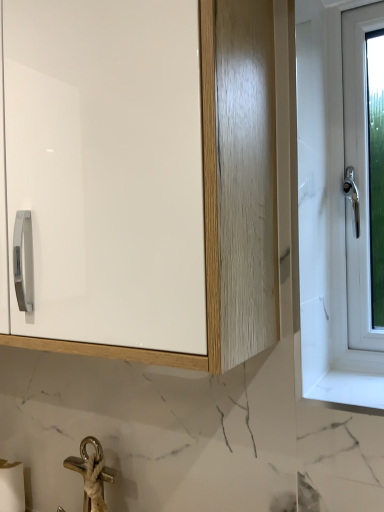
What is the approximate width of white matte toilet paper at lower left?

white matte toilet paper at lower left is 3.19 inches in width.

Where is `white matte toilet paper at lower left`? The image size is (384, 512). white matte toilet paper at lower left is located at coordinates (11, 487).

What is the approximate height of white matte toilet paper at lower left?

white matte toilet paper at lower left is 5.90 inches tall.

This screenshot has height=512, width=384. Describe the element at coordinates (11, 487) in the screenshot. I see `white matte toilet paper at lower left` at that location.

Where is `white glossy cabinet at upper left`? white glossy cabinet at upper left is located at coordinates 227,195.

Describe the element at coordinates (227, 195) in the screenshot. I see `white glossy cabinet at upper left` at that location.

Find the location of a particular element. Image resolution: width=384 pixels, height=512 pixels. white matte toilet paper at lower left is located at coordinates (11, 487).

Between white matte toilet paper at lower left and white glossy cabinet at upper left, which one appears on the left side from the viewer's perspective?

Positioned to the left is white matte toilet paper at lower left.

In the image, is white matte toilet paper at lower left positioned in front of or behind white glossy cabinet at upper left?

Clearly, white matte toilet paper at lower left is behind white glossy cabinet at upper left.

Does point (9, 486) lie in front of point (222, 353)?

That is False.

From the image's perspective, who appears lower, white matte toilet paper at lower left or white glossy cabinet at upper left?

white matte toilet paper at lower left.

From a real-world perspective, between white matte toilet paper at lower left and white glossy cabinet at upper left, who is vertically higher?

white glossy cabinet at upper left is physically above.

Considering the relative sizes of white matte toilet paper at lower left and white glossy cabinet at upper left in the image provided, is white matte toilet paper at lower left thinner than white glossy cabinet at upper left?

Yes.

Considering the sizes of objects white matte toilet paper at lower left and white glossy cabinet at upper left in the image provided, who is shorter, white matte toilet paper at lower left or white glossy cabinet at upper left?

Standing shorter between the two is white matte toilet paper at lower left.

Considering the sizes of objects white matte toilet paper at lower left and white glossy cabinet at upper left in the image provided, who is smaller, white matte toilet paper at lower left or white glossy cabinet at upper left?

white matte toilet paper at lower left is smaller.

Consider the image. Can we say white matte toilet paper at lower left lies outside white glossy cabinet at upper left?

Yes.

Looking at this image, are white matte toilet paper at lower left and white glossy cabinet at upper left far apart?

No, white matte toilet paper at lower left is not far away from white glossy cabinet at upper left.

Is white matte toilet paper at lower left aimed at white glossy cabinet at upper left?

No, white matte toilet paper at lower left is not facing towards white glossy cabinet at upper left.

In the scene shown: How many degrees apart are the facing directions of white matte toilet paper at lower left and white glossy cabinet at upper left?

There is a 1.18-degree angle between the facing directions of white matte toilet paper at lower left and white glossy cabinet at upper left.

The image size is (384, 512). I want to click on toilet paper below the white glossy cabinet at upper left (from the image's perspective), so click(x=11, y=487).

From the picture: Considering the positions of objects white glossy cabinet at upper left and white matte toilet paper at lower left in the image provided, who is more to the right, white glossy cabinet at upper left or white matte toilet paper at lower left?

From the viewer's perspective, white glossy cabinet at upper left appears more on the right side.

Is the position of white glossy cabinet at upper left more distant than that of white matte toilet paper at lower left?

No, white glossy cabinet at upper left is closer to the camera.

From the picture: Which is less distant, [103,356] or [18,497]?

Point [103,356].

From the image's perspective, between white glossy cabinet at upper left and white matte toilet paper at lower left, which one is located above?

white glossy cabinet at upper left appears higher in the image.

Looking at this image, from a real-world perspective, who is located higher, white glossy cabinet at upper left or white matte toilet paper at lower left?

From a 3D spatial view, white glossy cabinet at upper left is above.

Between white glossy cabinet at upper left and white matte toilet paper at lower left, which one has smaller width?

white matte toilet paper at lower left.

Does white glossy cabinet at upper left have a lesser height compared to white matte toilet paper at lower left?

No.

Between white glossy cabinet at upper left and white matte toilet paper at lower left, which one has smaller size?

Smaller between the two is white matte toilet paper at lower left.

Does white glossy cabinet at upper left contain white matte toilet paper at lower left?

That's incorrect, white matte toilet paper at lower left is not inside white glossy cabinet at upper left.

Are white glossy cabinet at upper left and white matte toilet paper at lower left located far from each other?

They are positioned close to each other.

Is white glossy cabinet at upper left looking in the opposite direction of white matte toilet paper at lower left?

No, white matte toilet paper at lower left is not at the back of white glossy cabinet at upper left.

At what (x,y) coordinates should I click in order to perform the action: click on cabinetry above the white matte toilet paper at lower left (from a real-world perspective). Please return your answer as a coordinate pair (x, y). This screenshot has height=512, width=384. Looking at the image, I should click on (227, 195).

Where is `toilet paper behind the white glossy cabinet at upper left`? The width and height of the screenshot is (384, 512). toilet paper behind the white glossy cabinet at upper left is located at coordinates (11, 487).

The image size is (384, 512). I want to click on toilet paper below the white glossy cabinet at upper left (from a real-world perspective), so click(x=11, y=487).